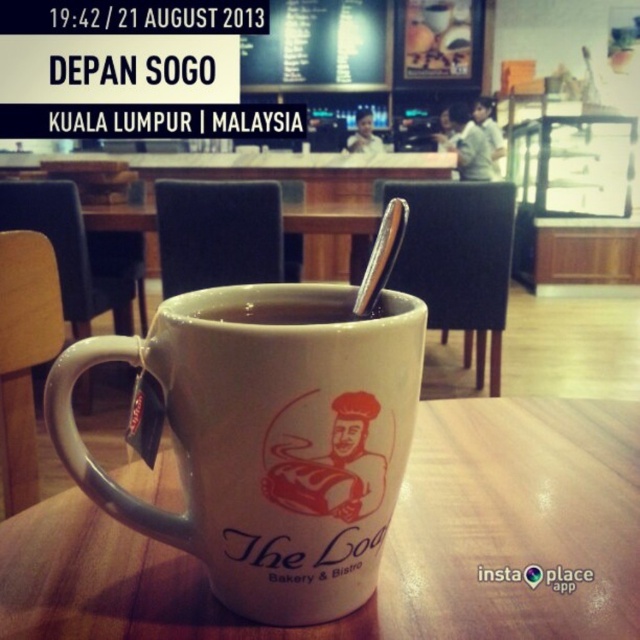
You are a customer at The Loaf Bakery and Bistro and you see two points in the image. The first point is at coordinate point (64, 445) and the second is at point (332, 316). Which point is closer to you?

Point (64, 445) is closer to you than point (332, 316).

You are sitting at the white wood table at center and want to reach the white matte cup at center. Which direction should you move to get it?

The white wood table at center is on the right side of the white matte cup at center, so you should move to your left to reach the cup.

You are a customer at The Loaf Bakery and Bistro in Kuala Lumpur. You see two points on the table. The first point is at coordinate point (625, 595) and the second point is at coordinate point (282, 314). Which point is closer to you?

Point (625, 595) is in front of point (282, 314), so it is closer to you.